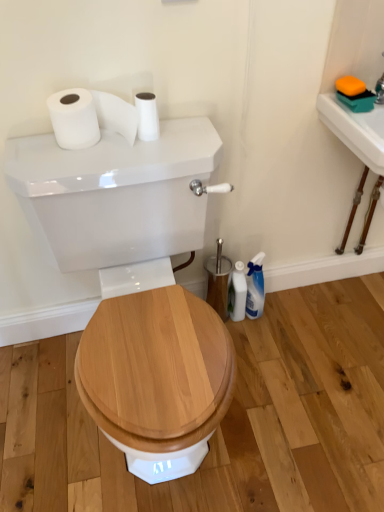
The image size is (384, 512). I want to click on vacant area that is situated to the right of white matte toilet paper at upper left, which appears as the first toilet paper when viewed from the left, so click(170, 143).